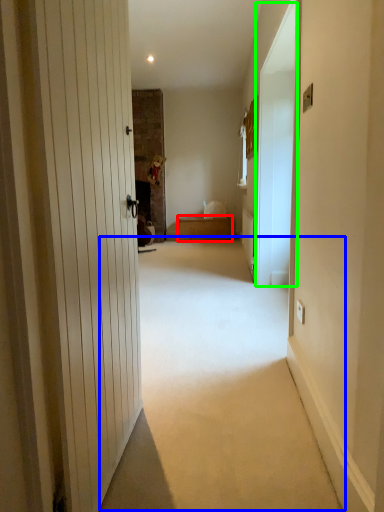
Question: Based on their relative distances, which object is farther from furniture (highlighted by a red box)? Choose from corridor (highlighted by a blue box) and screen door (highlighted by a green box).

Choices:
 (A) corridor
 (B) screen door

Answer: (A)